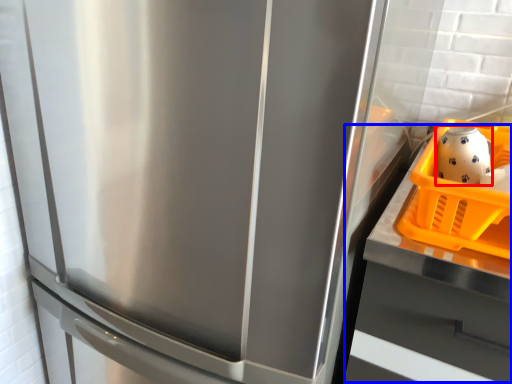
Question: Which of the following is the closest to the observer, tea pot (highlighted by a red box) or counter top (highlighted by a blue box)?

Choices:
 (A) tea pot
 (B) counter top

Answer: (B)